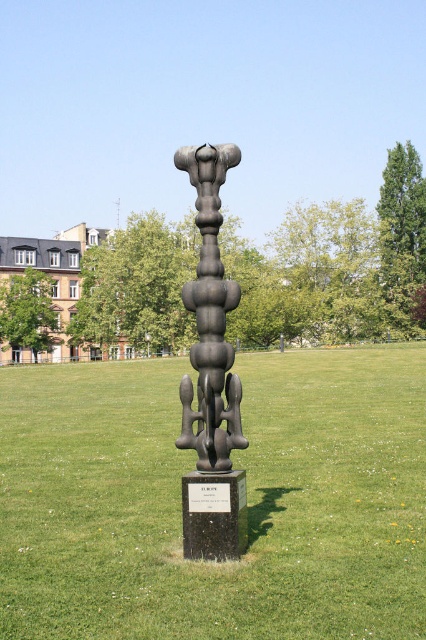
You are standing in the park and see both the black polished sculpture at center and the polished bronze sculpture at center. Which sculpture is positioned to the left?

The black polished sculpture at center is positioned to the left of the polished bronze sculpture at center.

You are an art student analyzing the sculpture in the park. You notice two parts of the sculpture labeled as the black polished sculpture at center and the polished bronze sculpture at center. Based on their positions, which one is situated higher up?

The polished bronze sculpture at center is situated higher up since the black polished sculpture at center is located below it.

You are standing at the center of the park and want to find the black polished sculpture at center. According to the coordinates provided, in which direction should you walk to locate it?

The black polished sculpture at center is located at coordinates point (247, 500), which means it is positioned to the right and slightly forward from your current position at the park center. You should walk towards the right and forward direction to reach it.